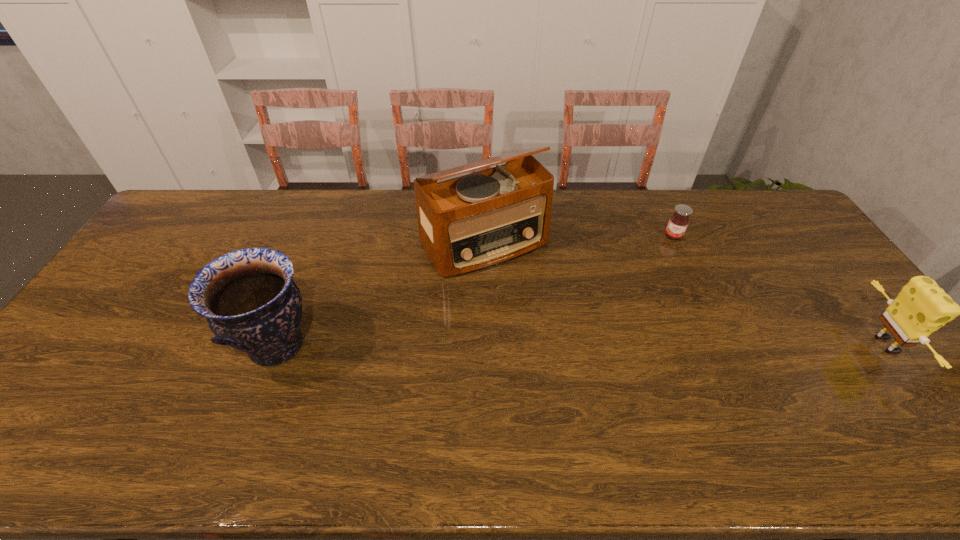
You are a GUI agent. You are given a task and a screenshot of the screen. Output one action in this format:
    pyautogui.click(x=<x>, y=<y>)
    Task: Click on the free area in between the third object from right to left and the sponge
    
    Given the screenshot: What is the action you would take?
    pyautogui.click(x=685, y=294)

Locate an element on the screen. unoccupied position between the third shortest object and the second object from right to left is located at coordinates (475, 291).

This screenshot has width=960, height=540. I want to click on free point between the third object from left to right and the radio receiver, so click(x=579, y=240).

The image size is (960, 540). In order to click on vacant area between the leftmost object and the rightmost object in this screenshot , I will do `click(583, 345)`.

At what (x,y) coordinates should I click in order to perform the action: click on vacant area that lies between the shortest object and the radio receiver. Please return your answer as a coordinate pair (x, y). Looking at the image, I should click on (579, 240).

Where is `free spot between the radio receiver and the sponge`? The width and height of the screenshot is (960, 540). free spot between the radio receiver and the sponge is located at coordinates (685, 294).

Locate an element on the screen. The image size is (960, 540). free space between the sponge and the second object from left to right is located at coordinates pyautogui.click(x=685, y=294).

Image resolution: width=960 pixels, height=540 pixels. Identify the location of free space between the leftmost object and the jam. (475, 291).

Locate an element on the screen. This screenshot has width=960, height=540. free space between the pottery and the tallest object is located at coordinates (381, 294).

This screenshot has width=960, height=540. Find the location of `object identified as the second closest to the third object from left to right`. object identified as the second closest to the third object from left to right is located at coordinates (921, 307).